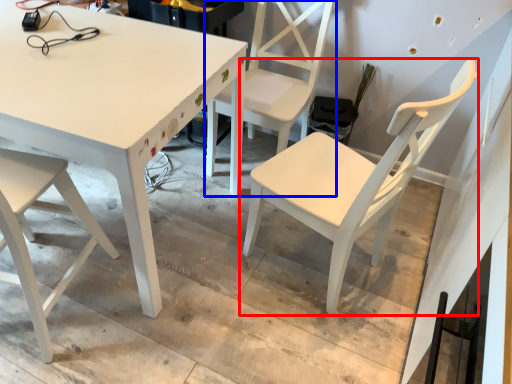
Question: Among these objects, which one is nearest to the camera, chair (highlighted by a red box) or chair (highlighted by a blue box)?

Choices:
 (A) chair
 (B) chair

Answer: (A)